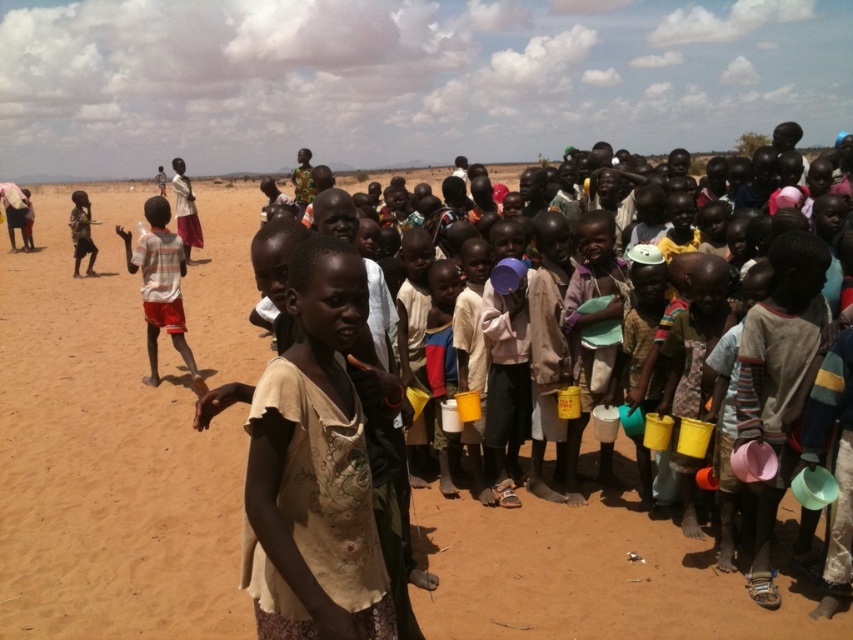
Describe the element at coordinates (160, 285) in the screenshot. The width and height of the screenshot is (853, 640). I see `striped cotton shirt at left` at that location.

Between striped cotton shirt at left and dark skin child at left, which one appears on the left side from the viewer's perspective?

dark skin child at left is more to the left.

Identify the location of striped cotton shirt at left. (160, 285).